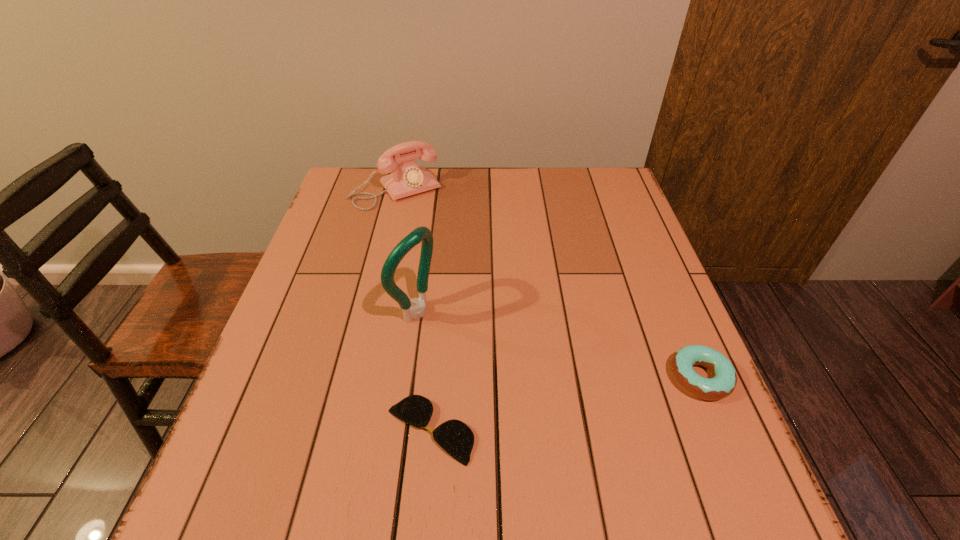
Find the location of `free point at the far edge`. free point at the far edge is located at coordinates (539, 178).

Locate an element on the screen. blank space at the near edge is located at coordinates (326, 440).

Locate an element on the screen. free space at the left edge is located at coordinates (366, 228).

Where is `free space at the right edge`? This screenshot has width=960, height=540. free space at the right edge is located at coordinates (602, 212).

This screenshot has height=540, width=960. In order to click on vacant space at the near left corner in this screenshot , I will do (x=268, y=429).

Where is `blank space at the far right corner of the desktop`? The height and width of the screenshot is (540, 960). blank space at the far right corner of the desktop is located at coordinates (606, 210).

In order to click on vacant space at the near right corner of the desktop in this screenshot , I will do `click(652, 461)`.

At what (x,y) coordinates should I click in order to perform the action: click on free space between the second shortest object and the shortest object. Please return your answer as a coordinate pair (x, y). Looking at the image, I should click on (564, 403).

The width and height of the screenshot is (960, 540). Identify the location of free spot between the second shortest object and the spectacles. (564, 403).

Find the location of a particular element. Image resolution: width=960 pixels, height=540 pixels. empty space between the spectacles and the doughnut is located at coordinates (564, 403).